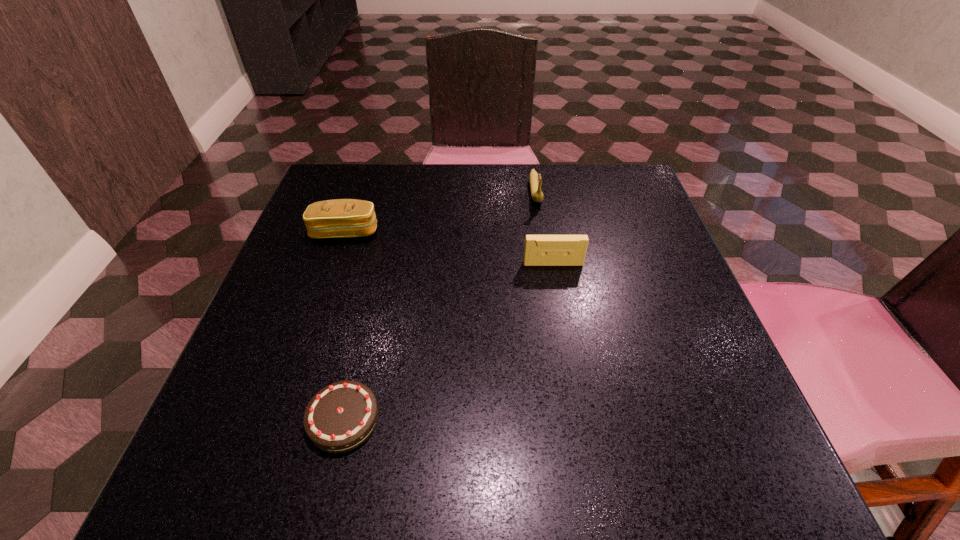
Locate an element on the screen. free space at the near left corner of the desktop is located at coordinates (228, 434).

At what (x,y) coordinates should I click in order to perform the action: click on vacant area that lies between the shortest object and the clutch bag. Please return your answer as a coordinate pair (x, y). This screenshot has height=540, width=960. Looking at the image, I should click on (345, 326).

The height and width of the screenshot is (540, 960). Find the location of `free spot between the videotape and the nearest object`. free spot between the videotape and the nearest object is located at coordinates (448, 341).

The image size is (960, 540). I want to click on unoccupied area between the chocolate cake and the farthest object, so click(440, 305).

You are a GUI agent. You are given a task and a screenshot of the screen. Output one action in this format:
    pyautogui.click(x=<x>, y=<y>)
    Task: Click on the empty space between the nearest object and the third nearest object
    Image resolution: width=960 pixels, height=540 pixels.
    Given the screenshot: What is the action you would take?
    pyautogui.click(x=345, y=326)

Locate an element on the screen. blank region between the second nearest object and the shortest object is located at coordinates (448, 341).

Where is `blank region between the tallest object and the chocolate cake`? The height and width of the screenshot is (540, 960). blank region between the tallest object and the chocolate cake is located at coordinates (440, 305).

Find the location of a particular element. free space between the tallest object and the chocolate cake is located at coordinates (440, 305).

The image size is (960, 540). What are the coordinates of `free space between the farthest object and the clutch bag` in the screenshot? It's located at (441, 212).

Find the location of a particular element. vacant area that lies between the videotape and the clutch bag is located at coordinates (449, 248).